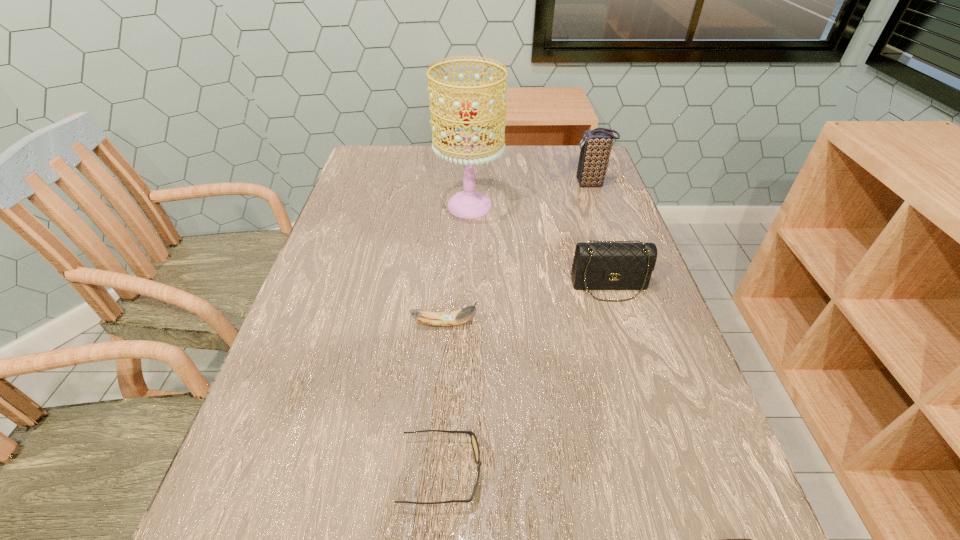
At what (x,y) coordinates should I click in order to perform the action: click on free region located 0.370m with the zip open on the farther clutch bag. Please return your answer as a coordinate pair (x, y). The height and width of the screenshot is (540, 960). Looking at the image, I should click on click(x=448, y=184).

The width and height of the screenshot is (960, 540). Find the location of `vacant space located 0.080m with the zip open on the farther clutch bag`. vacant space located 0.080m with the zip open on the farther clutch bag is located at coordinates tap(546, 184).

Identify the location of free space located 0.340m with the zip open on the farther clutch bag. The height and width of the screenshot is (540, 960). (458, 184).

Identify the location of free space located on the front flap of the shorter clutch bag. Image resolution: width=960 pixels, height=540 pixels. (651, 422).

Image resolution: width=960 pixels, height=540 pixels. I want to click on free space located 0.350m at the stem of the fourth farthest object, so click(x=649, y=323).

Locate an element on the screen. The image size is (960, 540). free space located on the front-facing side of the sunglasses is located at coordinates (x=642, y=471).

Find the location of a particular element. The height and width of the screenshot is (540, 960). object that is at the far edge is located at coordinates (596, 146).

What are the coordinates of `object present at the far right corner` in the screenshot? It's located at (596, 146).

I want to click on free space at the left edge of the desktop, so click(x=336, y=458).

The image size is (960, 540). I want to click on blank space at the right edge, so click(578, 212).